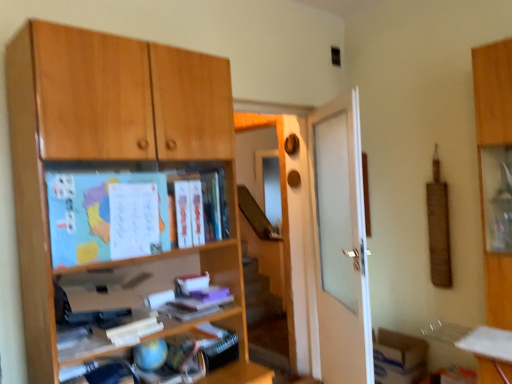
Question: Is white matte book at center, marked as the 1th book in a bottom-to-top arrangement, shorter than white matte door at center?

Choices:
 (A) no
 (B) yes

Answer: (B)

Question: Does white matte book at center, marked as the 1th book in a bottom-to-top arrangement, have a lesser width compared to white matte door at center?

Choices:
 (A) no
 (B) yes

Answer: (A)

Question: Is white matte book at center, the second book positioned from the top, turned away from white matte door at center?

Choices:
 (A) no
 (B) yes

Answer: (A)

Question: From a real-world perspective, is white matte book at center, the second book positioned from the top, over white matte door at center?

Choices:
 (A) no
 (B) yes

Answer: (A)

Question: From the image's perspective, is white matte book at center, marked as the 1th book in a bottom-to-top arrangement, under white matte door at center?

Choices:
 (A) yes
 (B) no

Answer: (A)

Question: Is point (356, 324) closer or farther from the camera than point (175, 296)?

Choices:
 (A) farther
 (B) closer

Answer: (A)

Question: From the image's perspective, is white matte door at center located above or below white matte book at center, marked as the 1th book in a bottom-to-top arrangement?

Choices:
 (A) below
 (B) above

Answer: (B)

Question: In terms of width, does white matte door at center look wider or thinner when compared to white matte book at center, the second book positioned from the top?

Choices:
 (A) thin
 (B) wide

Answer: (A)

Question: From a real-world perspective, is white matte door at center above or below white matte book at center, the second book positioned from the top?

Choices:
 (A) above
 (B) below

Answer: (A)

Question: Based on their sizes in the image, would you say white matte book at center, marked as the 1th book in a bottom-to-top arrangement, is bigger or smaller than matte paper book at center, the first book in the top-to-bottom sequence?

Choices:
 (A) big
 (B) small

Answer: (B)

Question: Do you think white matte book at center, the second book positioned from the top, is within matte paper book at center, which appears as the second book when ordered from the bottom, or outside of it?

Choices:
 (A) outside
 (B) inside

Answer: (A)

Question: From a real-world perspective, is white matte book at center, marked as the 1th book in a bottom-to-top arrangement, physically located above or below matte paper book at center, the first book in the top-to-bottom sequence?

Choices:
 (A) below
 (B) above

Answer: (A)

Question: From the image's perspective, relative to matte paper book at center, which appears as the second book when ordered from the bottom, is white matte book at center, marked as the 1th book in a bottom-to-top arrangement, above or below?

Choices:
 (A) above
 (B) below

Answer: (B)

Question: From the image's perspective, relative to transparent glass screen door at center, is blue matte map at upper left above or below?

Choices:
 (A) above
 (B) below

Answer: (A)

Question: Looking at their shapes, would you say blue matte map at upper left is wider or thinner than transparent glass screen door at center?

Choices:
 (A) thin
 (B) wide

Answer: (B)